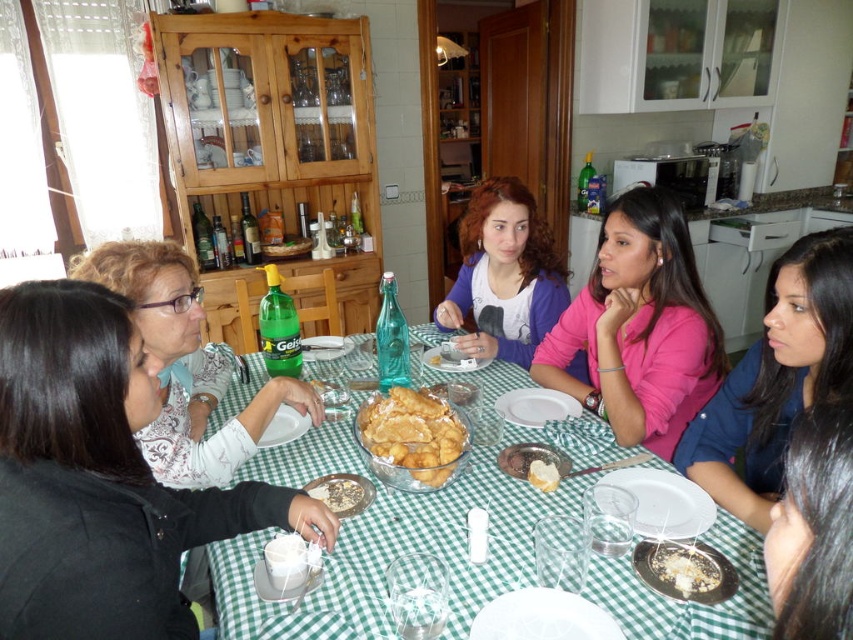
Question: Which point appears farthest from the camera in this image?

Choices:
 (A) (849, 600)
 (B) (682, 566)
 (C) (337, 502)
 (D) (207, 468)

Answer: (D)

Question: Can you confirm if pink matte sweater at center is wider than dark brown hair at lower right?

Choices:
 (A) yes
 (B) no

Answer: (A)

Question: Which object appears farthest from the camera in this image?

Choices:
 (A) matte white blouse at left
 (B) matte black jacket at lower left
 (C) green glass bowl at center

Answer: (A)

Question: Considering the relative positions of green glass bowl at center and dark brown hair at lower right in the image provided, where is green glass bowl at center located with respect to dark brown hair at lower right?

Choices:
 (A) right
 (B) left

Answer: (B)

Question: From the image, what is the correct spatial relationship of pink matte sweater at center in relation to white plastic plate at center?

Choices:
 (A) left
 (B) right

Answer: (B)

Question: Which point is closer to the camera?

Choices:
 (A) golden crispy pastry at center
 (B) white creamy dessert at center
 (C) pink matte sweater at center

Answer: (A)